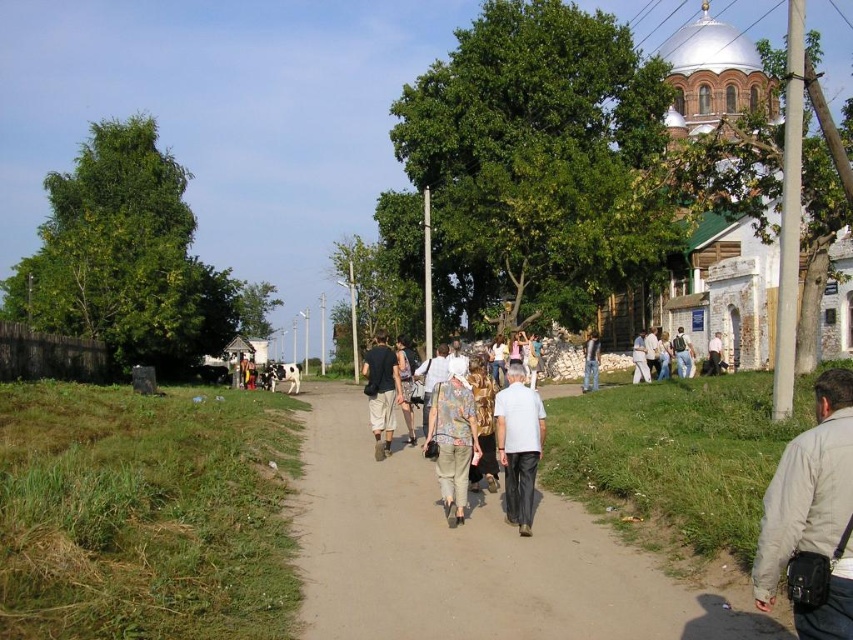
Question: Where is dirt road at center located in relation to light brown leather jacket at center in the image?

Choices:
 (A) right
 (B) left

Answer: (B)

Question: Considering the relative positions of light gray cotton shirt at center and white cotton shirt at center in the image provided, where is light gray cotton shirt at center located with respect to white cotton shirt at center?

Choices:
 (A) above
 (B) below

Answer: (B)

Question: Does gray fabric jacket at lower right lie behind light brown leather jacket at center?

Choices:
 (A) yes
 (B) no

Answer: (B)

Question: Which point is farther to the camera?

Choices:
 (A) (303, 577)
 (B) (387, 401)
 (C) (839, 502)

Answer: (B)

Question: Which of these objects is positioned closest to the light brown leather jacket at center?

Choices:
 (A) white cotton shirt at center
 (B) white stone church at right
 (C) gray fabric jacket at lower right
 (D) light gray cotton shirt at center

Answer: (C)

Question: Which object is positioned farthest from the gray cotton shirt at center?

Choices:
 (A) dark brown leather pants at center
 (B) white stone church at right
 (C) light gray cotton shirt at center
 (D) gray fabric jacket at lower right

Answer: (B)